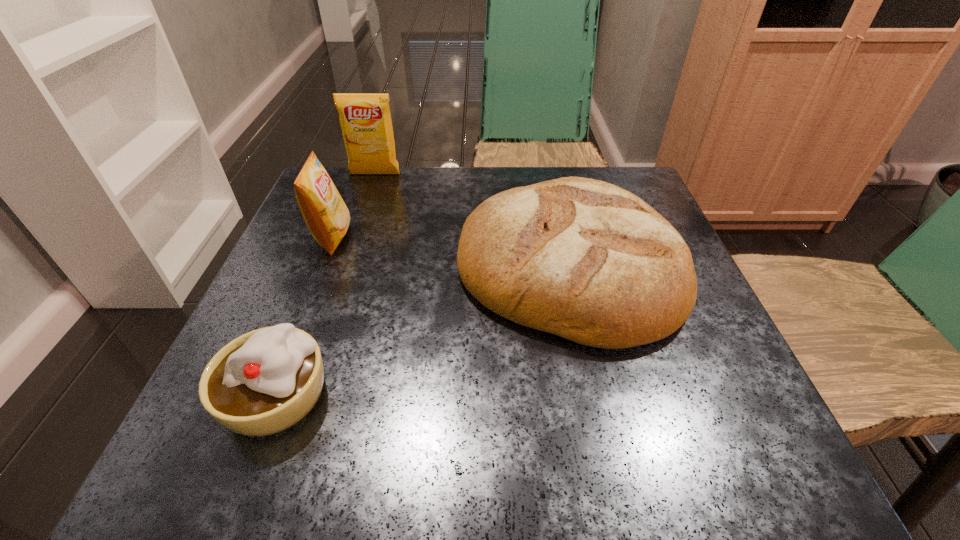
This screenshot has width=960, height=540. Find the location of `free location at the far left corner`. free location at the far left corner is located at coordinates (360, 197).

Find the location of a particular element. The height and width of the screenshot is (540, 960). free space at the near left corner is located at coordinates (289, 433).

Identify the location of vacant space at the far right corner of the desktop. [x=642, y=180].

The height and width of the screenshot is (540, 960). I want to click on free space at the near right corner of the desktop, so click(716, 418).

You are a GUI agent. You are given a task and a screenshot of the screen. Output one action in this format:
    pyautogui.click(x=<x>, y=<y>)
    Task: Click on the blank region between the farther crisp (potato chip) and the whipped cream
    The width and height of the screenshot is (960, 540).
    Given the screenshot: What is the action you would take?
    pyautogui.click(x=325, y=285)

In order to click on vacant area that lies between the rightmost object and the whipped cream in this screenshot , I will do `click(422, 330)`.

Identify the location of vacant space that is in between the tallest object and the second tallest object. The height and width of the screenshot is (540, 960). (354, 206).

You are a GUI agent. You are given a task and a screenshot of the screen. Output one action in this format:
    pyautogui.click(x=<x>, y=<y>)
    Task: Click on the vacant space that's between the rightmost object and the whipped cream
    
    Given the screenshot: What is the action you would take?
    pyautogui.click(x=422, y=330)

Locate an element on the screen. vacant area that lies between the rightmost object and the whipped cream is located at coordinates (422, 330).

Locate an element on the screen. The image size is (960, 540). free space that is in between the taller crisp (potato chip) and the whipped cream is located at coordinates (325, 285).